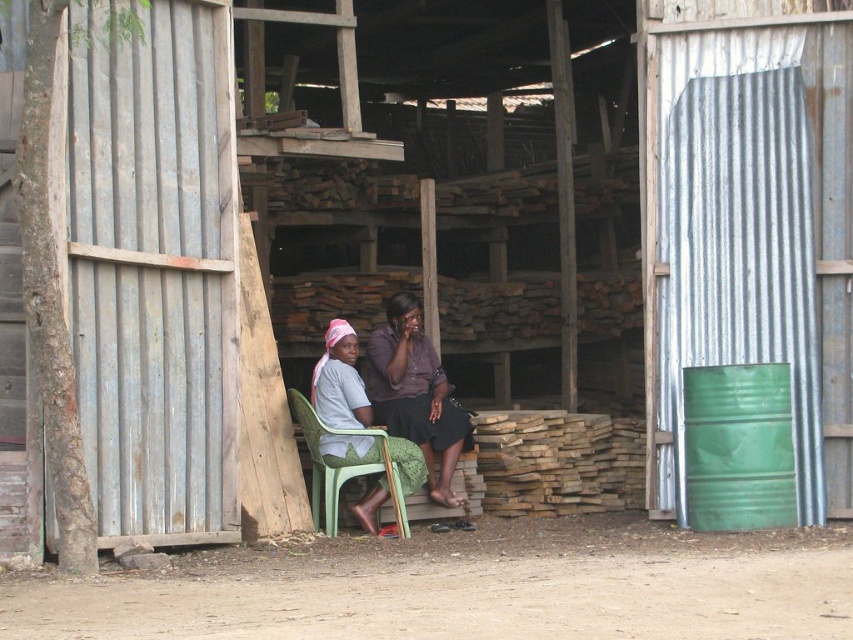
You are a painter who needs to place a ladder between the green matte barrel at right and the green plastic chair at center. Which object should the ladder be placed closer to?

The ladder should be placed closer to the green plastic chair at center because the green matte barrel at right is positioned over it, meaning the chair is lower and the ladder needs to reach the barrel.